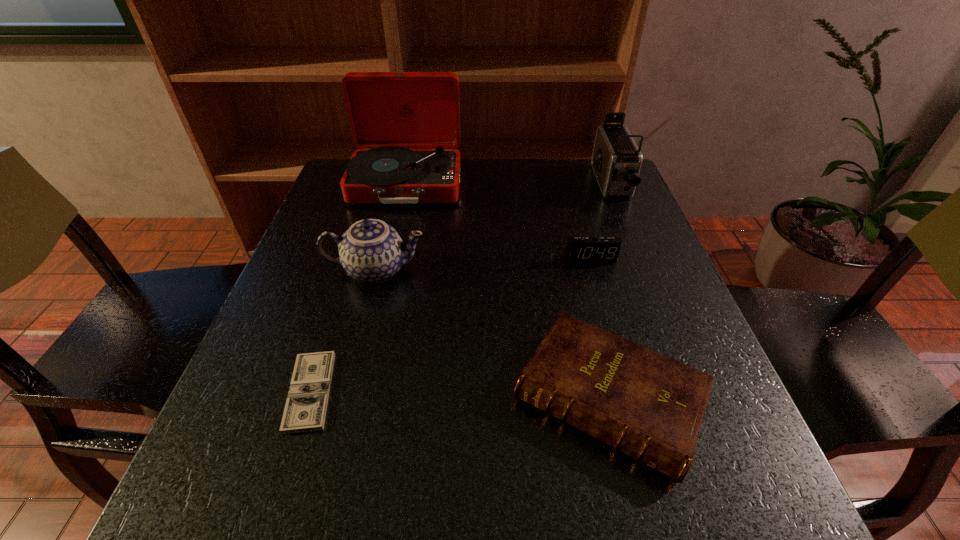
You are a GUI agent. You are given a task and a screenshot of the screen. Output one action in this format:
    pyautogui.click(x=<x>, y=<y>)
    Task: Click on the empty space between the shortest object and the alarm clock
    
    Given the screenshot: What is the action you would take?
    pyautogui.click(x=450, y=325)

At what (x,y) coordinates should I click in order to perform the action: click on empty location between the chinaware and the dollar. Please return your answer as a coordinate pair (x, y). Image resolution: width=960 pixels, height=540 pixels. Looking at the image, I should click on (343, 330).

Where is `free space that is in between the camcorder and the tallest object`? This screenshot has width=960, height=540. free space that is in between the camcorder and the tallest object is located at coordinates (x=509, y=184).

You are a GUI agent. You are given a task and a screenshot of the screen. Output one action in this format:
    pyautogui.click(x=<x>, y=<y>)
    Task: Click on the free space between the second tallest object and the chinaware
    Image resolution: width=960 pixels, height=540 pixels.
    Given the screenshot: What is the action you would take?
    pyautogui.click(x=493, y=227)

The width and height of the screenshot is (960, 540). I want to click on vacant region between the phonograph_record and the alarm clock, so click(x=498, y=221).

This screenshot has width=960, height=540. I want to click on free space between the shortest object and the chinaware, so click(x=343, y=330).

Where is `vacant space in between the third tallest object and the camcorder`? The height and width of the screenshot is (540, 960). vacant space in between the third tallest object and the camcorder is located at coordinates (493, 227).

You are a GUI agent. You are given a task and a screenshot of the screen. Output one action in this format:
    pyautogui.click(x=<x>, y=<y>)
    Task: Click on the free spot between the camcorder and the hardback book
    This screenshot has width=960, height=540.
    Given the screenshot: What is the action you would take?
    pyautogui.click(x=610, y=292)

Locate an element on the screen. This screenshot has height=540, width=960. free area in between the second tallest object and the alarm clock is located at coordinates pos(601,221).

Identify which object is located as the nearest to the dollar. Please provide its 2D coordinates. Your answer should be formatted as a tuple, i.e. [(x, y)], where the tuple contains the x and y coordinates of a point satisfying the conditions above.

[(371, 251)]